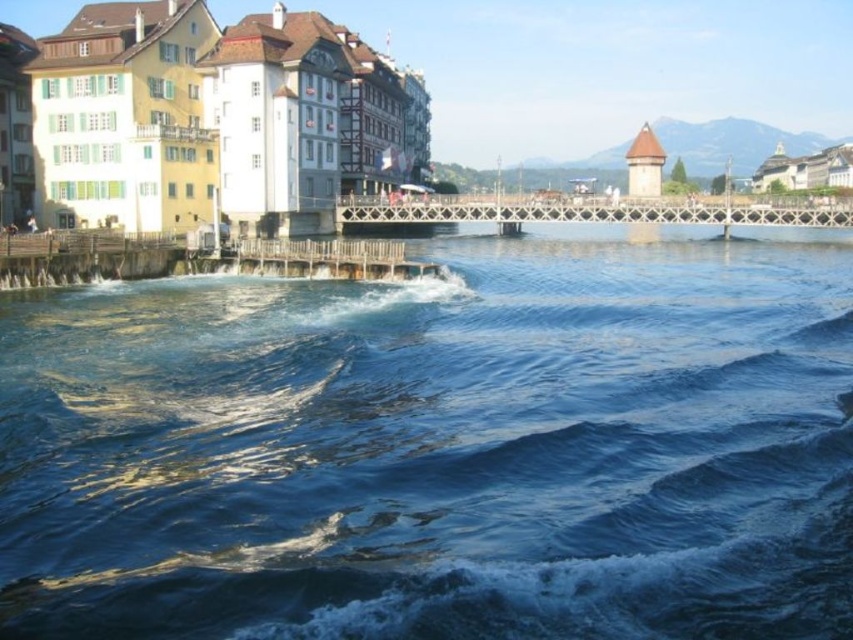
Can you confirm if blue clear water at center is shorter than white painted wooden buildings at left?

Indeed, blue clear water at center has a lesser height compared to white painted wooden buildings at left.

Locate an element on the screen. The width and height of the screenshot is (853, 640). blue clear water at center is located at coordinates (440, 445).

Identify the location of blue clear water at center. (440, 445).